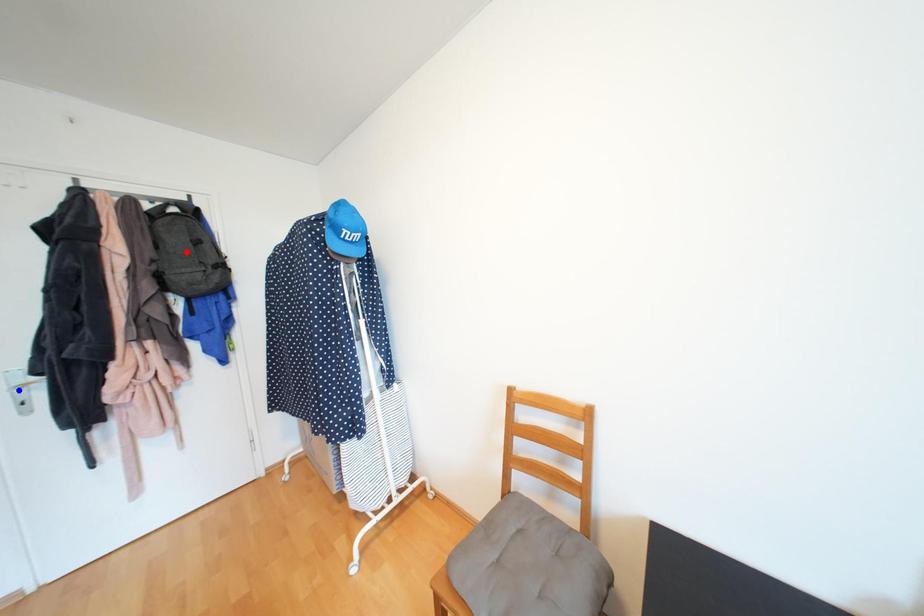
Question: Two points are marked on the image. Which point is closer to the camera?

Choices:
 (A) Blue point is closer.
 (B) Red point is closer.

Answer: (A)